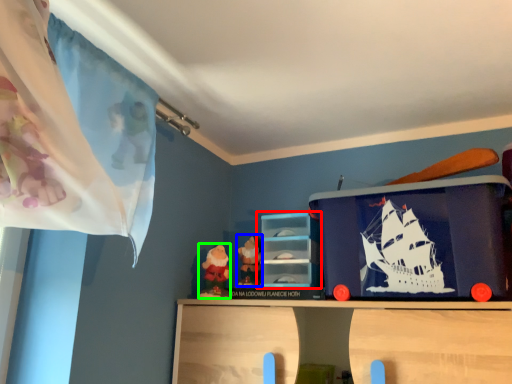
Question: Which object is positioned farthest from shelf (highlighted by a red box)? Select from toy (highlighted by a blue box) and toy (highlighted by a green box).

Choices:
 (A) toy
 (B) toy

Answer: (B)